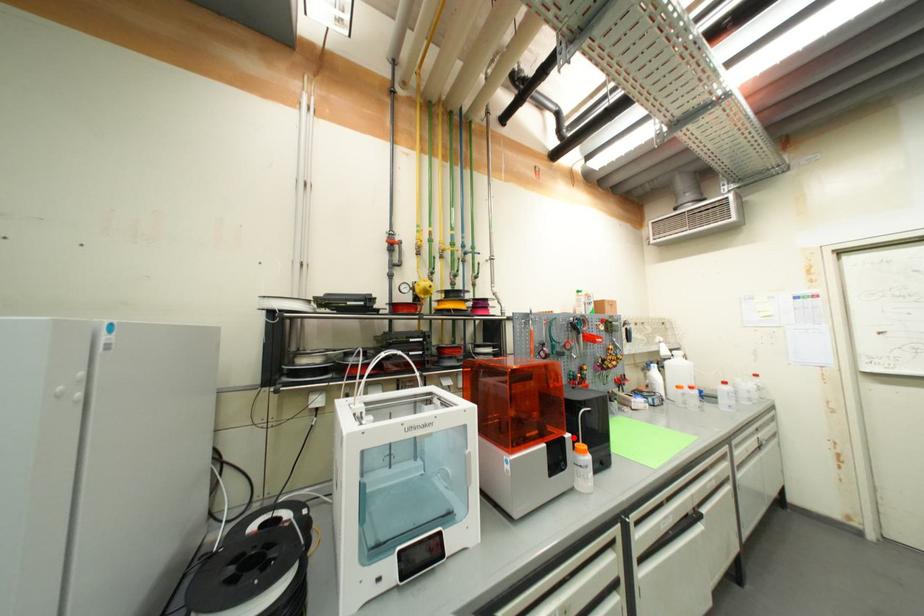
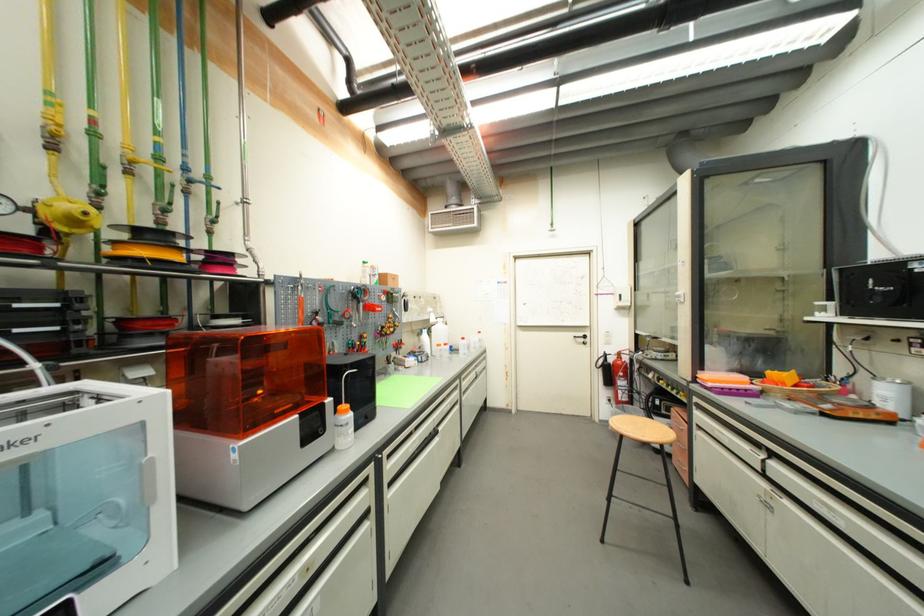
Find the pixel in the second image that matches the highlighted location in the first image.

(334, 402)